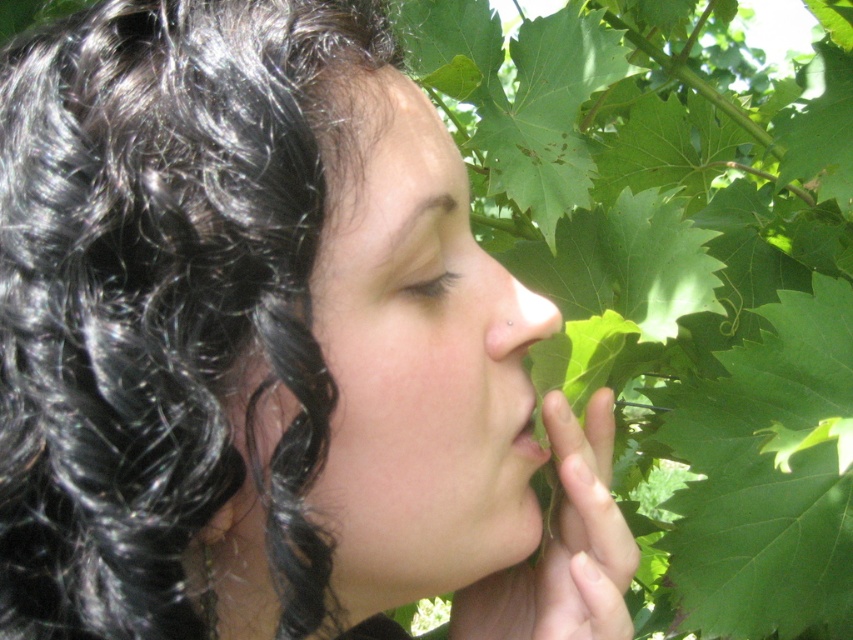
Based on the photo, you are a photographer trying to capture the interaction between the smooth skin face at center and the green leafy hand at center in the image. Which object would appear closer to the left side of your photo?

The smooth skin face at center is to the left of the green leafy hand at center, so it would appear closer to the left side of the photo.

You are a photographer adjusting your camera settings to capture the scene. You notice the green leafy hand at center and the matte skin nose at center. Which object should you focus on first if you want to ensure both are in sharp focus, considering their sizes?

The green leafy hand at center is larger in size than the matte skin nose at center. To ensure both are in sharp focus, focus on the larger object first, which is the green leafy hand at center.